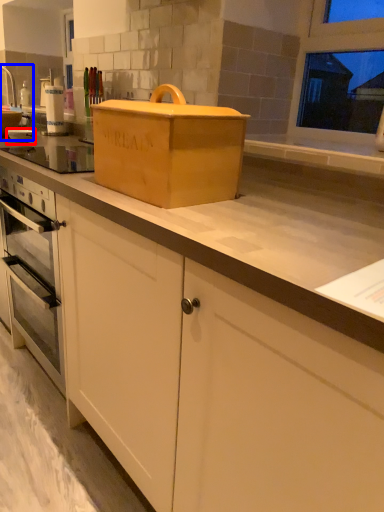
Question: Which of the following is the farthest to the observer, appliance (highlighted by a red box) or sink (highlighted by a blue box)?

Choices:
 (A) appliance
 (B) sink

Answer: (B)